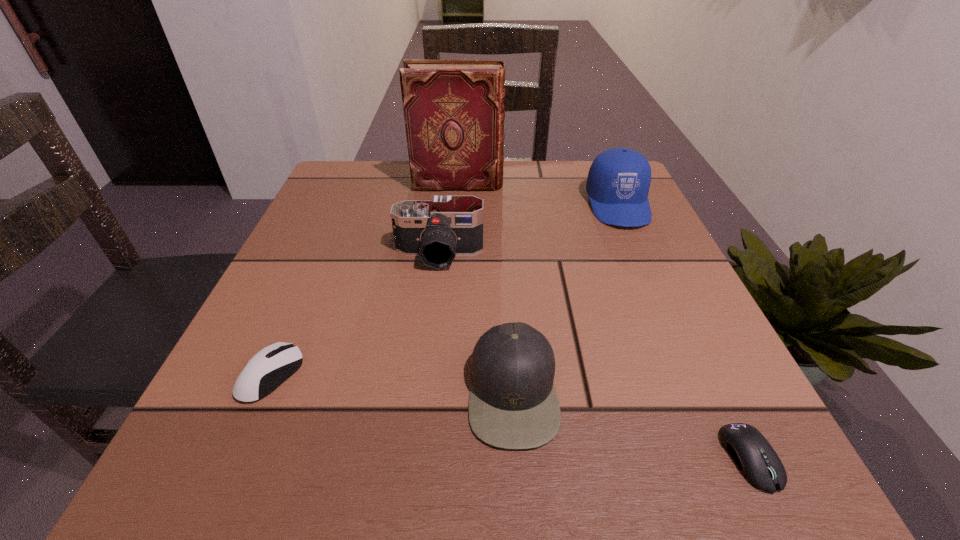
Locate an element on the screen. Image resolution: width=960 pixels, height=540 pixels. hardback book is located at coordinates (454, 114).

Locate an element on the screen. The width and height of the screenshot is (960, 540). the farther cap is located at coordinates (618, 182).

Locate an element on the screen. Image resolution: width=960 pixels, height=540 pixels. the taller cap is located at coordinates [618, 182].

At what (x,y) coordinates should I click in order to perform the action: click on camera. Please return your answer as a coordinate pair (x, y). Image resolution: width=960 pixels, height=540 pixels. Looking at the image, I should click on (448, 226).

At what (x,y) coordinates should I click in order to perform the action: click on the third shortest object. Please return your answer as a coordinate pair (x, y). The height and width of the screenshot is (540, 960). Looking at the image, I should click on (513, 404).

Locate an element on the screen. This screenshot has width=960, height=540. the nearer cap is located at coordinates (513, 404).

The height and width of the screenshot is (540, 960). What are the coordinates of `the leftmost object` in the screenshot? It's located at (271, 366).

What are the coordinates of `the farther computer equipment` in the screenshot? It's located at (271, 366).

Image resolution: width=960 pixels, height=540 pixels. Identify the location of the shorter computer equipment. (758, 462).

Where is `the right computer equipment`? the right computer equipment is located at coordinates (758, 462).